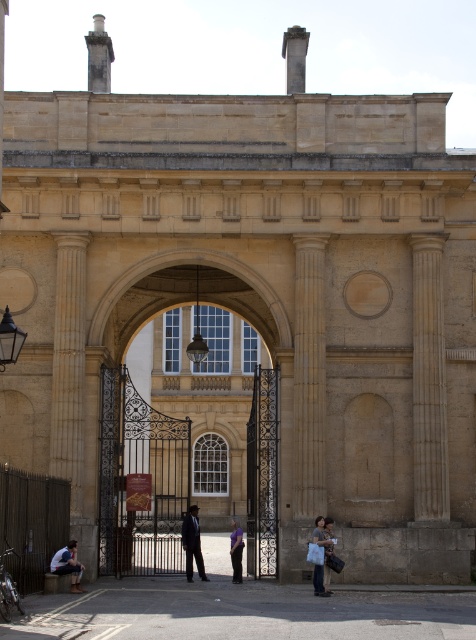
You are standing in front of the grand building and notice a dark brown wrought iron gate at center and a light blue denim jacket at lower left. Which object is positioned to the right side of the other?

The dark brown wrought iron gate at center is to the right of the light blue denim jacket at lower left.

You are an architect visiting the historical building and notice the smooth stone column at right and the light brown leather jacket at lower right. Which object is taller?

The smooth stone column at right is taller than the light brown leather jacket at lower right.